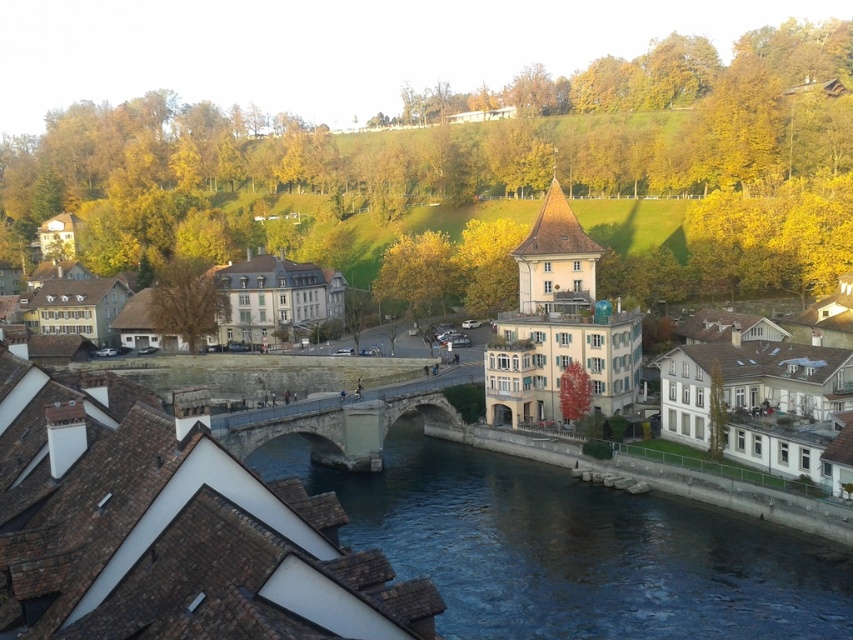
Is blue stone bridge at center to the left of stone bridge at center from the viewer's perspective?

Incorrect, blue stone bridge at center is not on the left side of stone bridge at center.

Is blue stone bridge at center above stone bridge at center?

Incorrect, blue stone bridge at center is not positioned above stone bridge at center.

What do you see at coordinates (573, 548) in the screenshot? The width and height of the screenshot is (853, 640). I see `blue stone bridge at center` at bounding box center [573, 548].

The image size is (853, 640). Identify the location of blue stone bridge at center. (573, 548).